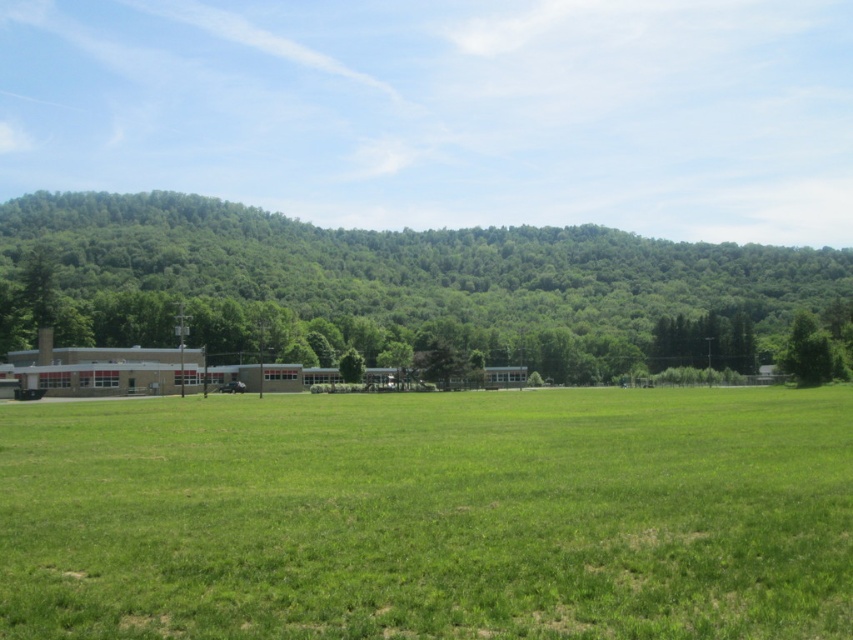
Is point (357, 513) farther from camera compared to point (213, 289)?

No, it is not.

Is green grass at center shorter than green leafy tree at left?

Indeed, green grass at center has a lesser height compared to green leafy tree at left.

Is point (183, 570) closer to camera compared to point (16, 225)?

Yes, point (183, 570) is closer to viewer.

Identify the location of green grass at center. This screenshot has height=640, width=853. (430, 515).

Is point (467, 515) positioned after point (782, 356)?

No, it is in front of (782, 356).

Between point (646, 564) and point (788, 344), which one is positioned behind?

Positioned behind is point (788, 344).

Who is more forward, (x=169, y=614) or (x=791, y=348)?

Positioned in front is point (x=169, y=614).

Locate an element on the screen. green grass at center is located at coordinates (430, 515).

Which is more to the left, green leafy tree at left or green leafy tree at right?

Positioned to the left is green leafy tree at left.

Is green leafy tree at left smaller than green leafy tree at right?

Incorrect, green leafy tree at left is not smaller in size than green leafy tree at right.

This screenshot has height=640, width=853. Describe the element at coordinates (405, 262) in the screenshot. I see `green leafy tree at left` at that location.

Find the location of `green leafy tree at left`. green leafy tree at left is located at coordinates (405, 262).